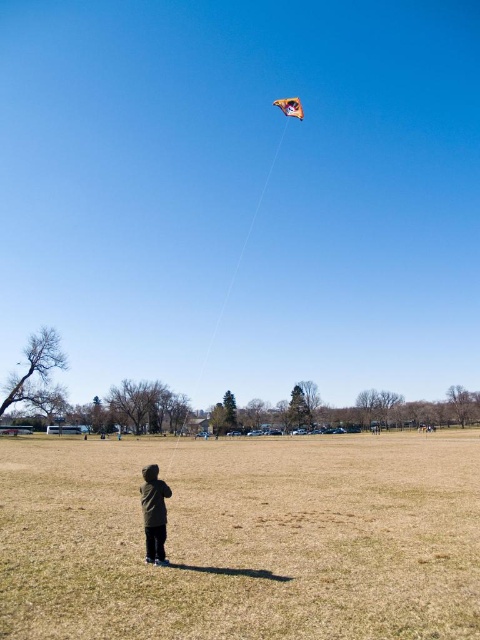
Question: Which object appears closest to the camera in this image?

Choices:
 (A) dark green jacket at center
 (B) orange fabric kite at upper center

Answer: (A)

Question: Which point is closer to the camera?

Choices:
 (A) (295, 113)
 (B) (127, 468)

Answer: (B)

Question: Can you confirm if brown grass at center is wider than dark green jacket at center?

Choices:
 (A) no
 (B) yes

Answer: (B)

Question: Considering the real-world distances, which object is farthest from the orange fabric kite at upper center?

Choices:
 (A) brown grass at center
 (B) dark green jacket at center

Answer: (B)

Question: Can you confirm if brown grass at center is bigger than orange fabric kite at upper center?

Choices:
 (A) no
 (B) yes

Answer: (A)

Question: Can you confirm if brown grass at center is positioned to the right of orange fabric kite at upper center?

Choices:
 (A) yes
 (B) no

Answer: (B)